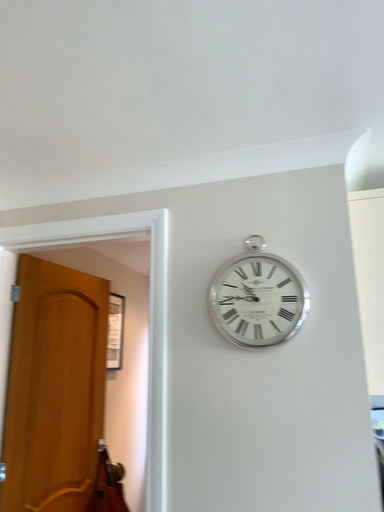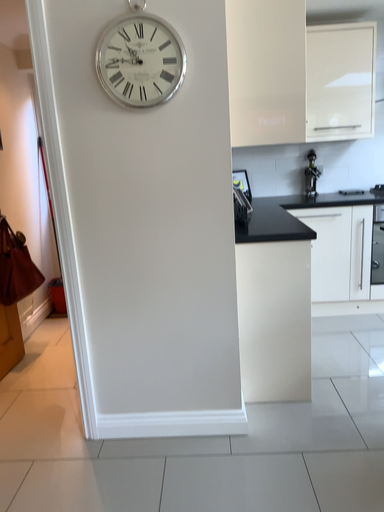
Question: Which way did the camera rotate in the video?

Choices:
 (A) rotated upward
 (B) rotated downward

Answer: (B)